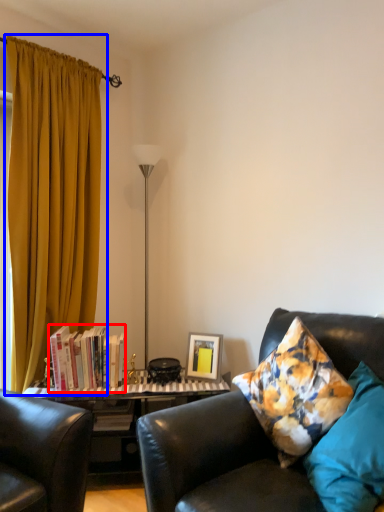
Question: Among these objects, which one is nearest to the camera, book (highlighted by a red box) or curtain (highlighted by a blue box)?

Choices:
 (A) book
 (B) curtain

Answer: (B)